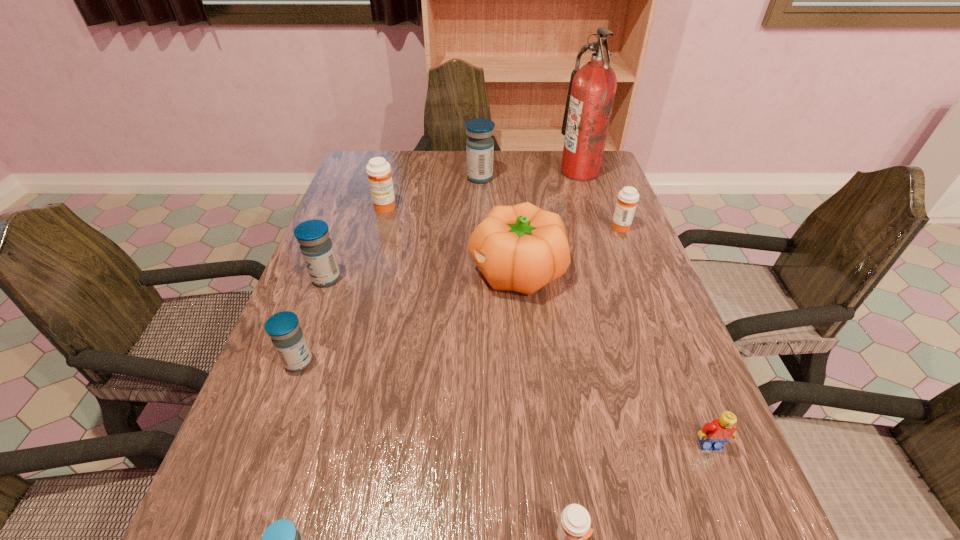
Select which object is the fifth closest to the leftmost orange medicine. Please provide its 2D coordinates. Your answer should be formatted as a tuple, i.e. [(x, y)], where the tuple contains the x and y coordinates of a point satisfying the conditions above.

[(592, 88)]

Identify which object is the second nearest to the Lego. Please provide its 2D coordinates. Your answer should be formatted as a tuple, i.e. [(x, y)], where the tuple contains the x and y coordinates of a point satisfying the conditions above.

[(521, 248)]

The width and height of the screenshot is (960, 540). I want to click on medicine object that ranks as the fourth closest to the fourth farthest medicine, so click(281, 539).

Where is `medicine that is the third closest to the red Lego`? The width and height of the screenshot is (960, 540). medicine that is the third closest to the red Lego is located at coordinates (281, 539).

Select which blue medicine is the closest to the pumpkin. Please provide its 2D coordinates. Your answer should be formatted as a tuple, i.e. [(x, y)], where the tuple contains the x and y coordinates of a point satisfying the conditions above.

[(479, 145)]

Where is `blue medicine that is the closest to the Lego`? Image resolution: width=960 pixels, height=540 pixels. blue medicine that is the closest to the Lego is located at coordinates (281, 539).

Locate which orange medicine is the closest to the leftmost orange medicine. Please provide its 2D coordinates. Your answer should be formatted as a tuple, i.e. [(x, y)], where the tuple contains the x and y coordinates of a point satisfying the conditions above.

[(628, 197)]

I want to click on the third closest orange medicine to the tallest object, so coord(574,528).